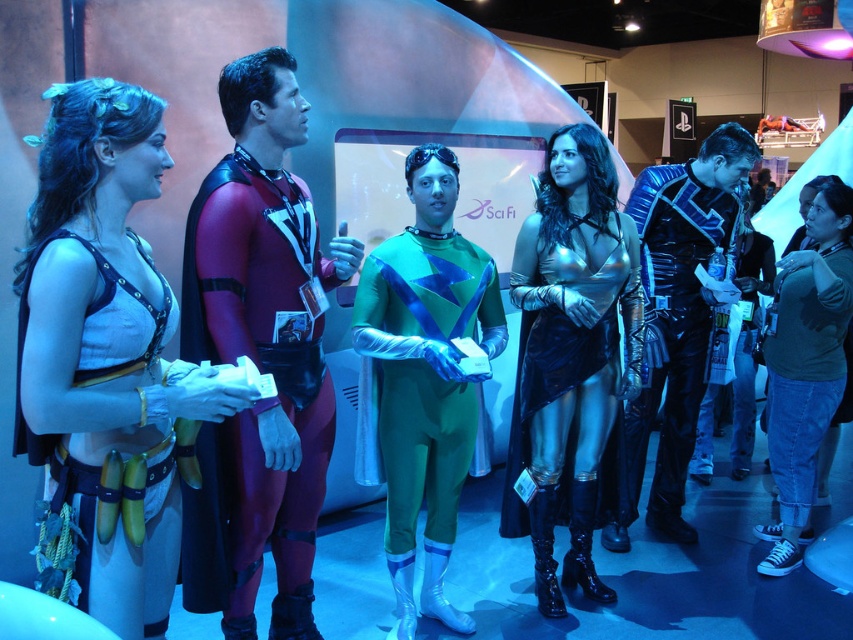
Does maroon spandex suit at center have a greater width compared to metallic blue armor at right?

No.

What do you see at coordinates (260, 371) in the screenshot?
I see `maroon spandex suit at center` at bounding box center [260, 371].

Which is behind, point (244, 196) or point (685, 440)?

Positioned behind is point (685, 440).

Identify the location of maroon spandex suit at center. This screenshot has height=640, width=853. (260, 371).

Which is above, green metallic suit at center or metallic blue armor at right?

metallic blue armor at right

Who is positioned more to the left, green metallic suit at center or metallic blue armor at right?

green metallic suit at center

Does point (445, 376) come closer to viewer compared to point (636, 188)?

That is True.

Locate an element on the screen. The height and width of the screenshot is (640, 853). green metallic suit at center is located at coordinates (425, 376).

Is green metallic suit at center positioned in front of metallic gold dress at center?

Yes, it is.

Between point (424, 156) and point (599, 419), which one is positioned behind?

Point (599, 419)

Does point (440, 284) lie in front of point (589, 262)?

That is True.

Image resolution: width=853 pixels, height=640 pixels. In order to click on green metallic suit at center in this screenshot , I will do `click(425, 376)`.